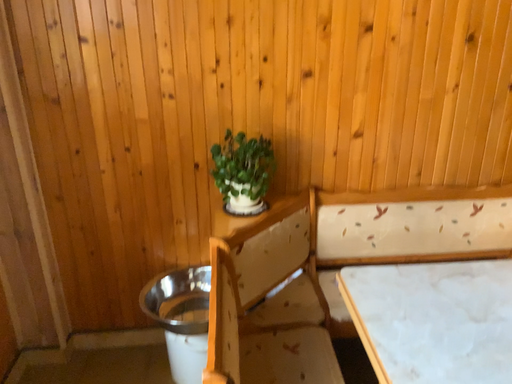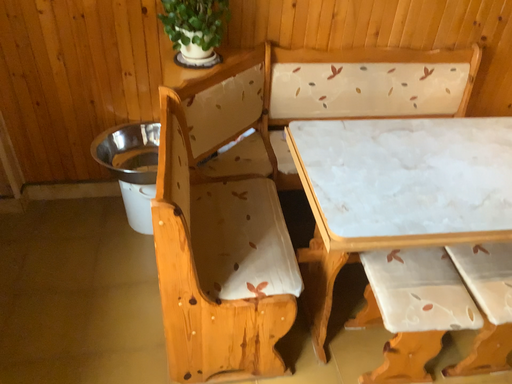
Question: Which way did the camera rotate in the video?

Choices:
 (A) rotated upward
 (B) rotated downward

Answer: (B)